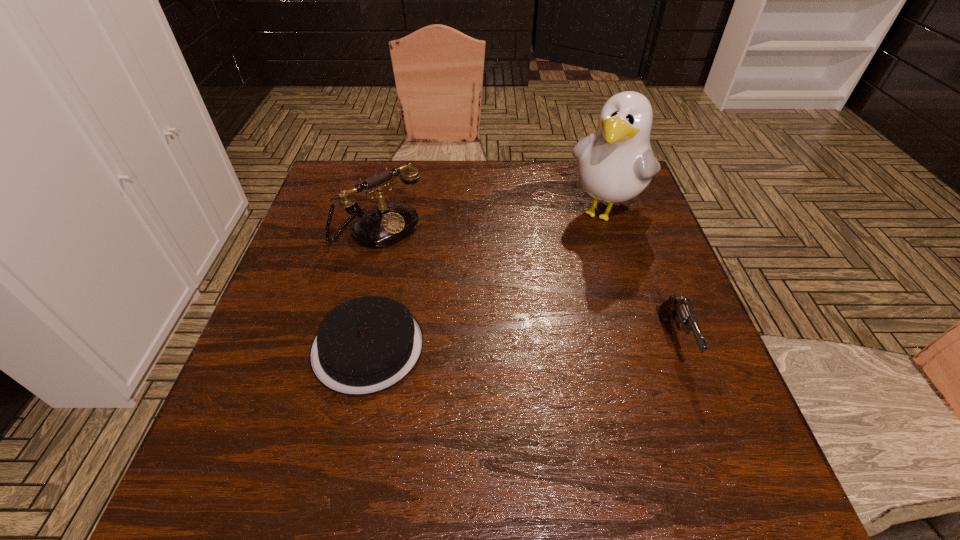
I want to click on free space located 0.340m on the beak of the gull, so click(x=524, y=324).

Locate an element on the screen. vacant region located 0.210m on the beak of the gull is located at coordinates (552, 286).

At what (x,y) coordinates should I click in order to perform the action: click on object that is at the far edge. Please return your answer as a coordinate pair (x, y). Looking at the image, I should click on (615, 163).

At what (x,y) coordinates should I click in order to perform the action: click on object present at the near edge. Please return your answer as a coordinate pair (x, y). The height and width of the screenshot is (540, 960). Looking at the image, I should click on (366, 345).

What are the coordinates of `pancake at the left edge` in the screenshot? It's located at (366, 345).

What are the coordinates of `telephone that is at the left edge` in the screenshot? It's located at (387, 224).

Find the location of a particular element. The height and width of the screenshot is (540, 960). pistol that is at the right edge is located at coordinates (676, 308).

Identify the location of gull that is at the right edge. Image resolution: width=960 pixels, height=540 pixels. (x=615, y=163).

This screenshot has height=540, width=960. In order to click on object present at the near left corner in this screenshot , I will do `click(366, 345)`.

This screenshot has width=960, height=540. I want to click on object that is at the far right corner, so click(x=615, y=163).